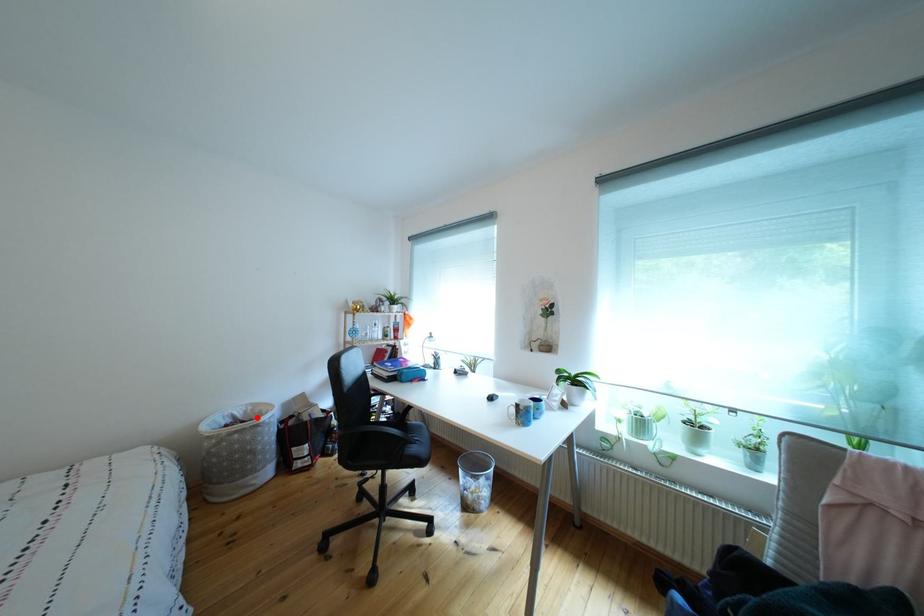
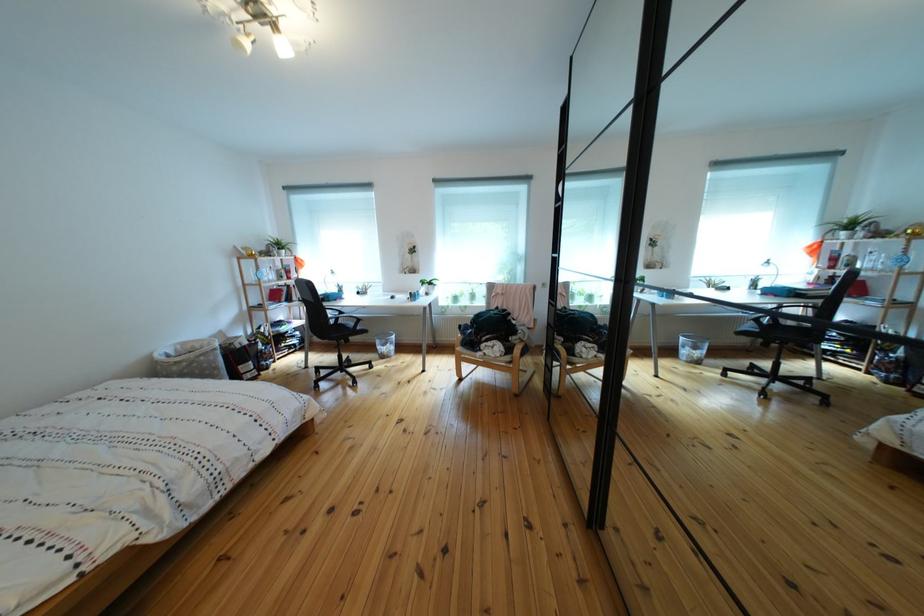
The point at the highlighted location is marked in the first image. Where is the corresponding point in the second image?

(187, 355)